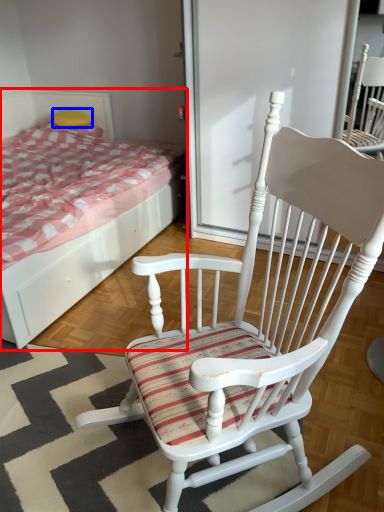
Question: Which object appears farthest to the camera in this image, bed (highlighted by a red box) or pillow (highlighted by a blue box)?

Choices:
 (A) bed
 (B) pillow

Answer: (B)